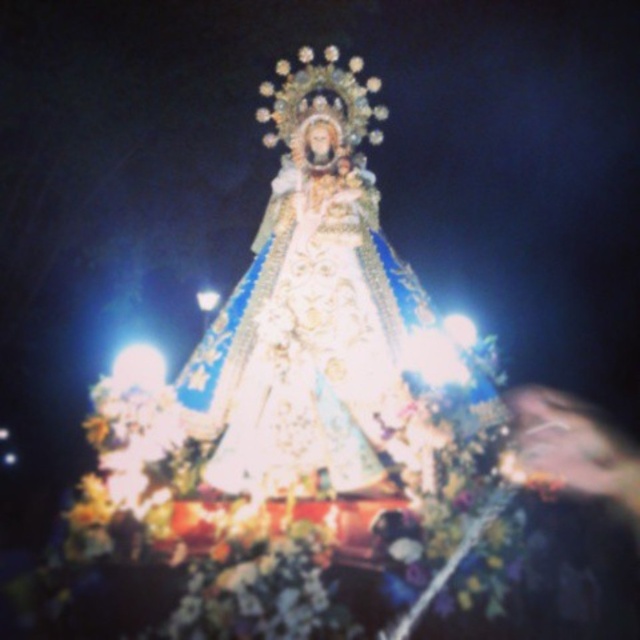
Question: Does white satin dress at center appear under smooth skin face at lower right?

Choices:
 (A) yes
 (B) no

Answer: (B)

Question: Among these points, which one is nearest to the camera?

Choices:
 (A) (576, 596)
 (B) (262, 356)

Answer: (A)

Question: Does white satin dress at center lie in front of smooth skin face at lower right?

Choices:
 (A) yes
 (B) no

Answer: (B)

Question: From the image, what is the correct spatial relationship of white satin dress at center in relation to smooth skin face at lower right?

Choices:
 (A) below
 (B) above

Answer: (B)